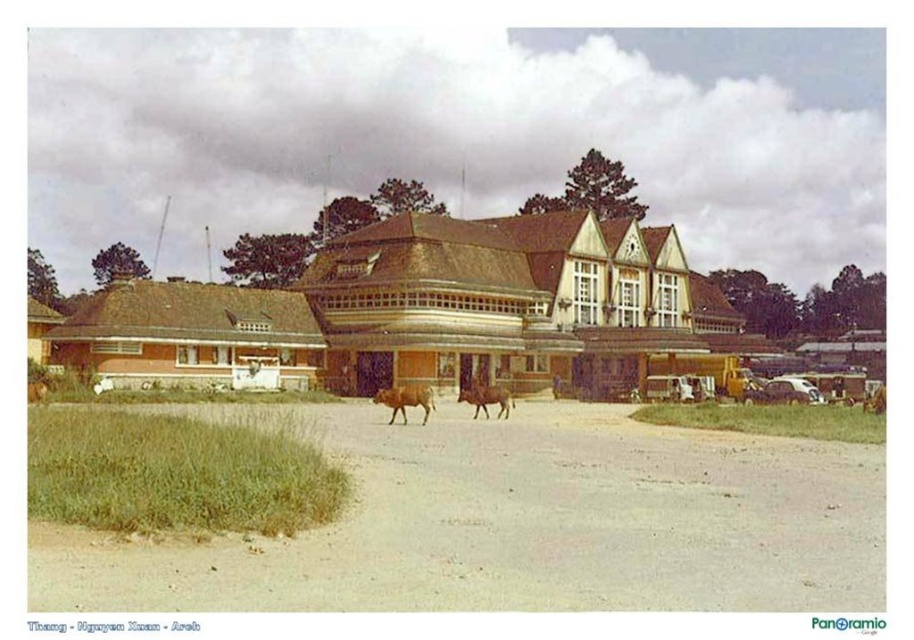
Can you confirm if brown sandy dirt field at lower center is positioned below brown leather cow at center?

Incorrect, brown sandy dirt field at lower center is not positioned below brown leather cow at center.

Is brown sandy dirt field at lower center further to camera compared to brown leather cow at center?

No, it is not.

Between point (608, 436) and point (466, 396), which one is positioned behind?

The point (466, 396) is behind.

Find the location of a particular element. This screenshot has height=640, width=914. brown sandy dirt field at lower center is located at coordinates (523, 524).

Is the position of brown sandy dirt field at lower center more distant than that of brown matte bull at center?

That is False.

Between brown sandy dirt field at lower center and brown matte bull at center, which one appears on the left side from the viewer's perspective?

From the viewer's perspective, brown matte bull at center appears more on the left side.

Does point (105, 588) lie in front of point (389, 392)?

Yes, point (105, 588) is in front of point (389, 392).

Where is `brown sandy dirt field at lower center`? brown sandy dirt field at lower center is located at coordinates (523, 524).

Who is more distant from viewer, (392,412) or (473,401)?

Point (473,401)

Between brown matte bull at center and brown leather cow at center, which one has more height?

brown matte bull at center is taller.

Is point (404, 387) positioned behind point (513, 403)?

No, (404, 387) is in front of (513, 403).

Locate an element on the screen. brown matte bull at center is located at coordinates (405, 400).